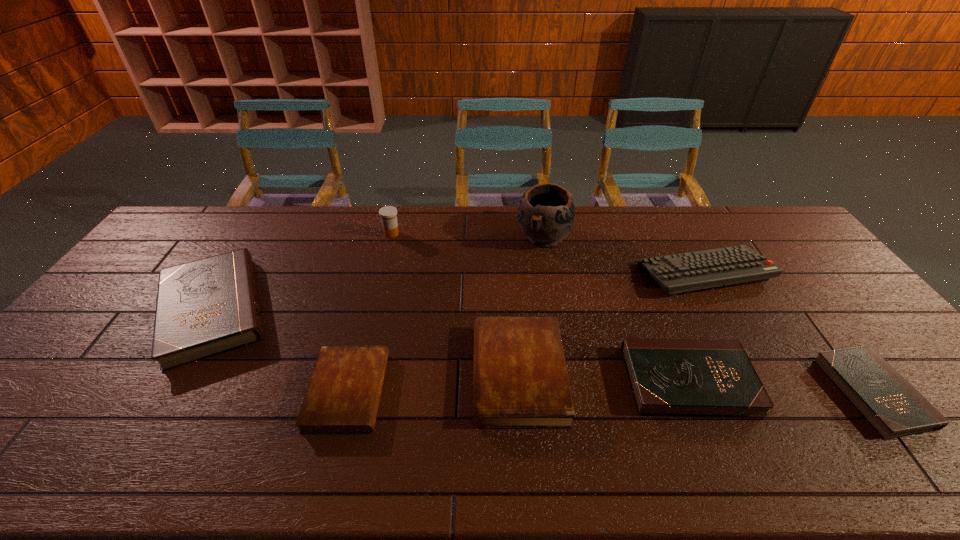
At what (x,y) coordinates should I click in order to perform the action: click on green Bible that is the third closest to the third Bible from left to right. Please return your answer as a coordinate pair (x, y). Looking at the image, I should click on (890, 404).

Image resolution: width=960 pixels, height=540 pixels. Find the location of `free space that satisfies the following two spatial constraints: 1. on the front side of the second green Bible from right to left; 2. on the spine side of the smaller reddish-brown Bible`. free space that satisfies the following two spatial constraints: 1. on the front side of the second green Bible from right to left; 2. on the spine side of the smaller reddish-brown Bible is located at coordinates (693, 392).

Identify the location of free space in the image that satisfies the following two spatial constraints: 1. on the front side of the tallest object; 2. on the spine side of the bigger reddish-brown Bible. (567, 374).

This screenshot has width=960, height=540. What are the coordinates of `free space that satisfies the following two spatial constraints: 1. on the label of the rightmost Bible; 2. on the right side of the seventh shortest object` in the screenshot? It's located at (352, 393).